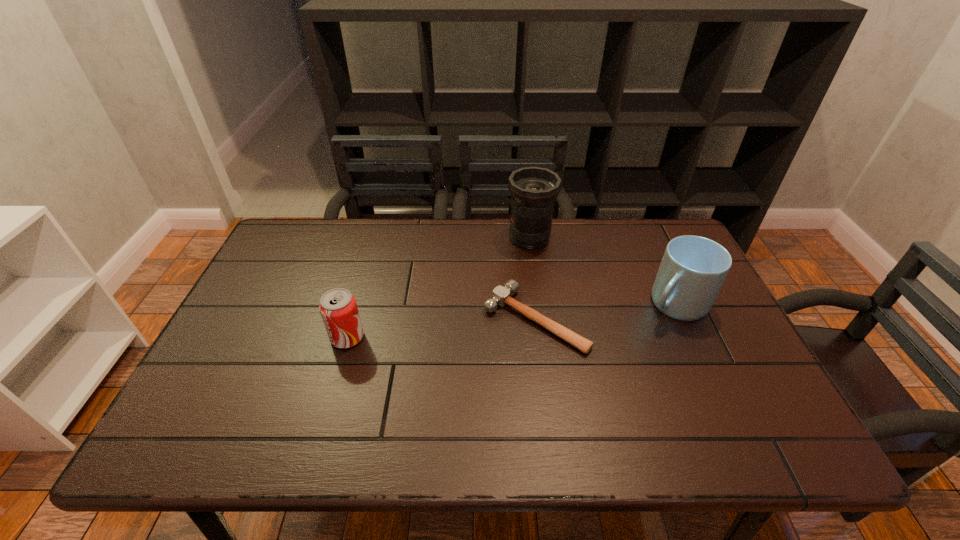
Identify the location of object that is the second closest to the shortest object. (693, 268).

Where is `vacant space that satisfies the following two spatial constraints: 1. on the back side of the hammer; 2. on the right side of the rightmost object`? vacant space that satisfies the following two spatial constraints: 1. on the back side of the hammer; 2. on the right side of the rightmost object is located at coordinates (533, 304).

Identify the location of vacant space that satisfies the following two spatial constraints: 1. on the back side of the third tallest object; 2. on the left side of the telephoto lens. This screenshot has width=960, height=540. (376, 238).